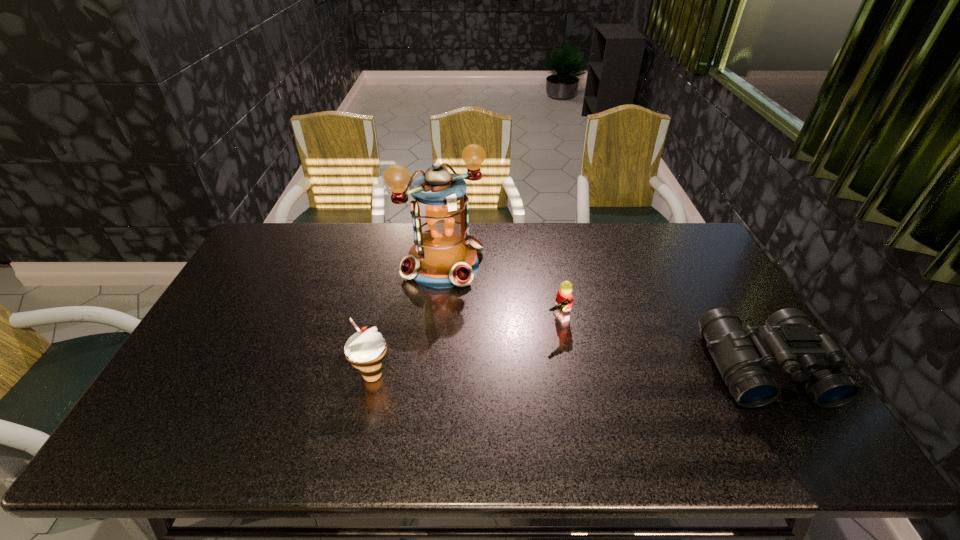
At what (x,y) coordinates should I click in order to perform the action: click on icecream. Please return your answer as a coordinate pair (x, y). This screenshot has width=960, height=540. Looking at the image, I should click on (366, 349).

This screenshot has height=540, width=960. Find the location of `the rightmost object`. the rightmost object is located at coordinates (743, 358).

Where is `the tallest object`? This screenshot has width=960, height=540. the tallest object is located at coordinates (444, 255).

Where is `lantern`? lantern is located at coordinates (444, 255).

The width and height of the screenshot is (960, 540). What are the coordinates of `the third object from left to right` in the screenshot? It's located at click(x=564, y=299).

Where is `Lego`? This screenshot has height=540, width=960. Lego is located at coordinates (564, 299).

This screenshot has height=540, width=960. In order to click on free spot located on the left of the icecream in this screenshot , I will do `click(246, 375)`.

This screenshot has height=540, width=960. In order to click on free location located on the front-facing side of the lantern in this screenshot , I will do click(474, 299).

Where is `free space located 0.390m on the front-facing side of the lantern`? The width and height of the screenshot is (960, 540). free space located 0.390m on the front-facing side of the lantern is located at coordinates (540, 373).

At what (x,y) coordinates should I click in order to perform the action: click on vacant point located 0.060m on the front-facing side of the lantern. Please return your answer as a coordinate pair (x, y). Looking at the image, I should click on (474, 299).